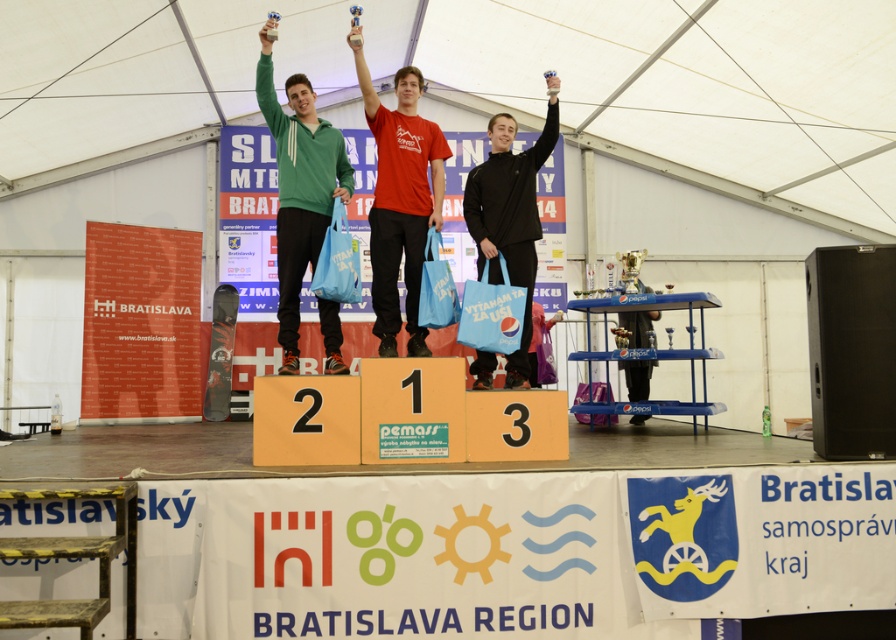
Question: Which of these objects is positioned farthest from the black matte jacket at center?

Choices:
 (A) matte green hoodie at center
 (B) matte red t-shirt at center
 (C) blue plastic shelf at center

Answer: (C)

Question: Among these objects, which one is farthest from the camera?

Choices:
 (A) matte green hoodie at center
 (B) blue plastic shelf at center
 (C) black matte jacket at center
 (D) matte red t-shirt at center

Answer: (B)

Question: Based on their relative distances, which object is nearer to the matte green hoodie at center?

Choices:
 (A) black matte jacket at center
 (B) blue plastic shelf at center

Answer: (A)

Question: Does matte red t-shirt at center come in front of black matte jacket at center?

Choices:
 (A) no
 (B) yes

Answer: (B)

Question: Can you confirm if matte green hoodie at center is positioned to the right of blue plastic shelf at center?

Choices:
 (A) yes
 (B) no

Answer: (B)

Question: Does matte green hoodie at center come behind blue plastic shelf at center?

Choices:
 (A) no
 (B) yes

Answer: (A)